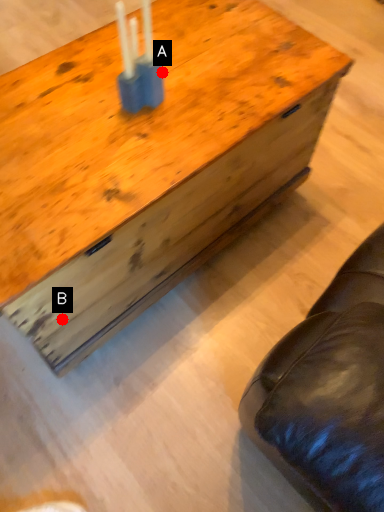
Question: Two points are circled on the image, labeled by A and B beside each circle. Among these points, which one is farthest from the camera?

Choices:
 (A) A is further
 (B) B is further

Answer: (A)